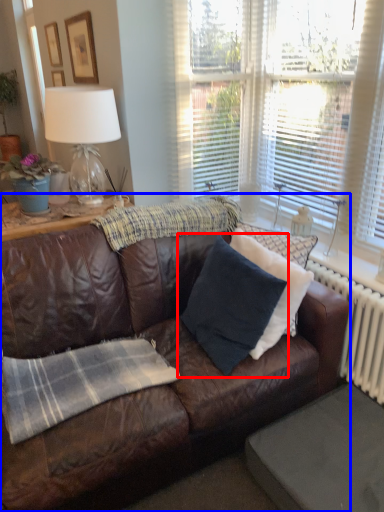
Question: Which of the following is the farthest to the observer, pillow (highlighted by a red box) or studio couch (highlighted by a blue box)?

Choices:
 (A) pillow
 (B) studio couch

Answer: (A)